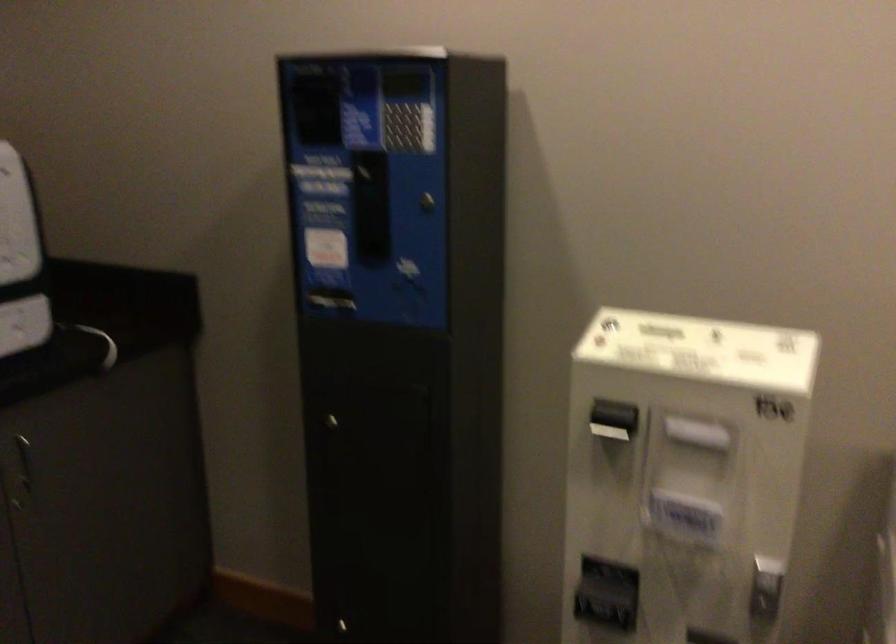
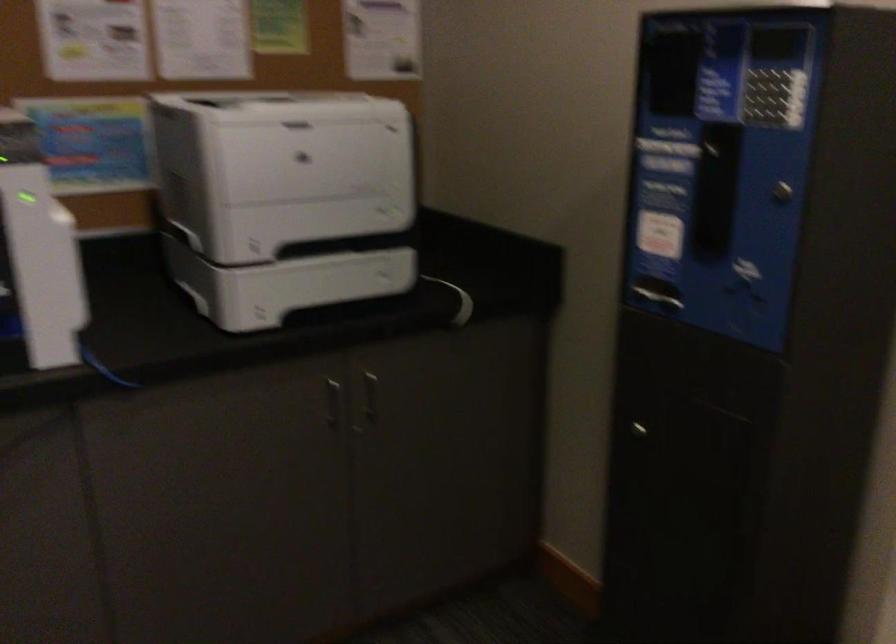
The point at (407, 136) is marked in the first image. Where is the corresponding point in the second image?

(765, 106)